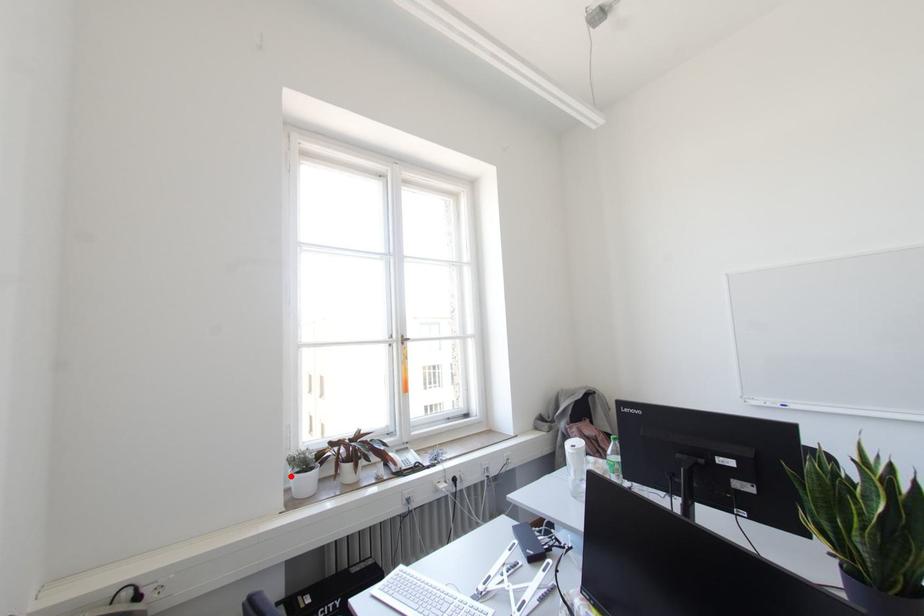
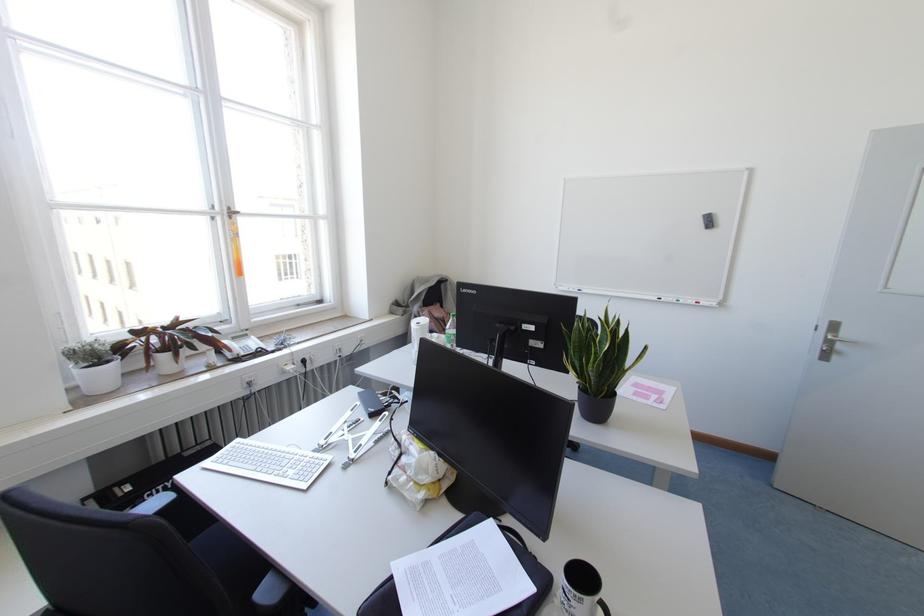
In the second image, find the point that corresponds to the highlighted location in the first image.

(75, 371)